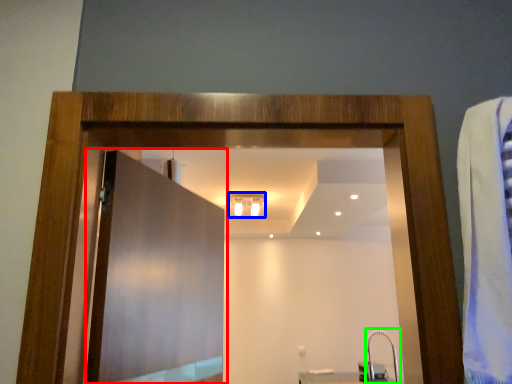
Question: Which is nearer to the door (highlighted by a red box)? light fixture (highlighted by a blue box) or faucet (highlighted by a green box).

Choices:
 (A) light fixture
 (B) faucet

Answer: (A)